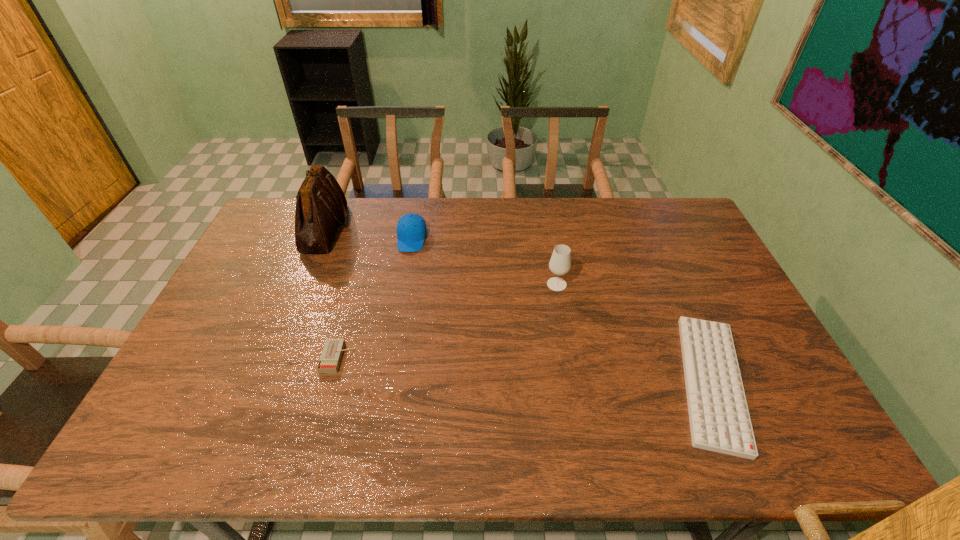
Locate an element on the screen. This screenshot has width=960, height=540. the leftmost object is located at coordinates (321, 205).

At what (x,y) coordinates should I click in order to perform the action: click on shoulder bag. Please return your answer as a coordinate pair (x, y). Image resolution: width=960 pixels, height=540 pixels. Looking at the image, I should click on (321, 205).

Locate an element on the screen. This screenshot has width=960, height=540. the third farthest object is located at coordinates (560, 263).

This screenshot has width=960, height=540. I want to click on the second tallest object, so click(x=560, y=263).

This screenshot has width=960, height=540. Find the location of `the third shortest object`. the third shortest object is located at coordinates (411, 229).

The height and width of the screenshot is (540, 960). I want to click on cap, so click(x=411, y=229).

At what (x,y) coordinates should I click in order to perform the action: click on the fourth object from right to left. Please return your answer as a coordinate pair (x, y). Looking at the image, I should click on (330, 359).

Identify the location of computer keyboard. (719, 418).

The image size is (960, 540). Find the location of `vacant space located on the front of the shoulder bag`. vacant space located on the front of the shoulder bag is located at coordinates (297, 298).

The width and height of the screenshot is (960, 540). I want to click on vacant region located 0.210m on the left of the glass, so click(480, 284).